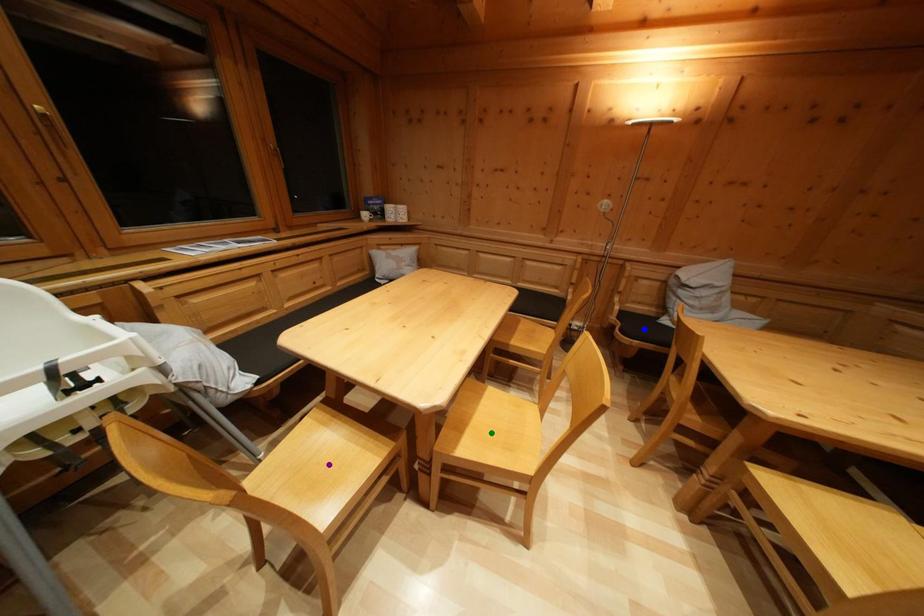
Order these from nearest to farthest:
blue point | green point | purple point

blue point
green point
purple point